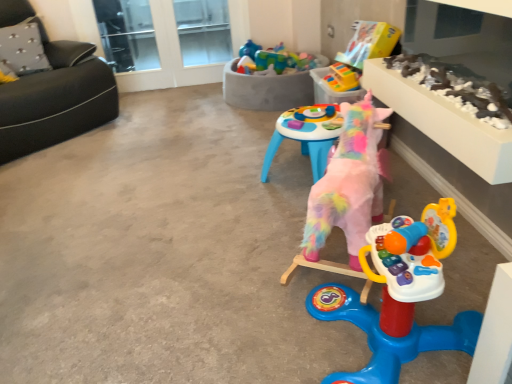
Question: Considering the positions of point (403, 112) and point (186, 34), is point (403, 112) closer or farther from the camera than point (186, 34)?

Choices:
 (A) closer
 (B) farther

Answer: (A)

Question: Considering the positions of white textured table at upper right and transparent glass window at upper center in the image, is white textured table at upper right bigger or smaller than transparent glass window at upper center?

Choices:
 (A) small
 (B) big

Answer: (A)

Question: Which object is positioned farthest from the transparent glass door at upper center?

Choices:
 (A) transparent glass window at upper center
 (B) fluffy pink unicorn at center, the 2th toy in the front-to-back sequence
 (C) transparent glass screen door at upper center
 (D) rubberized plastic toy at upper center, arranged as the 4th toy when viewed from the front
 (E) black leather couch at left

Answer: (B)

Question: Considering the real-world distances, which object is farthest from the fluffy pink unicorn at center, the 2th toy in the front-to-back sequence?

Choices:
 (A) rubberized plastic toy at upper center, arranged as the 4th toy when viewed from the front
 (B) plush pink unicorn at center, arranged as the fifth toy when viewed from the back
 (C) gray fabric pillow at upper left
 (D) transparent glass screen door at upper center
 (E) translucent plastic toys at upper center, which is the 1th toy in back-to-front order

Answer: (D)